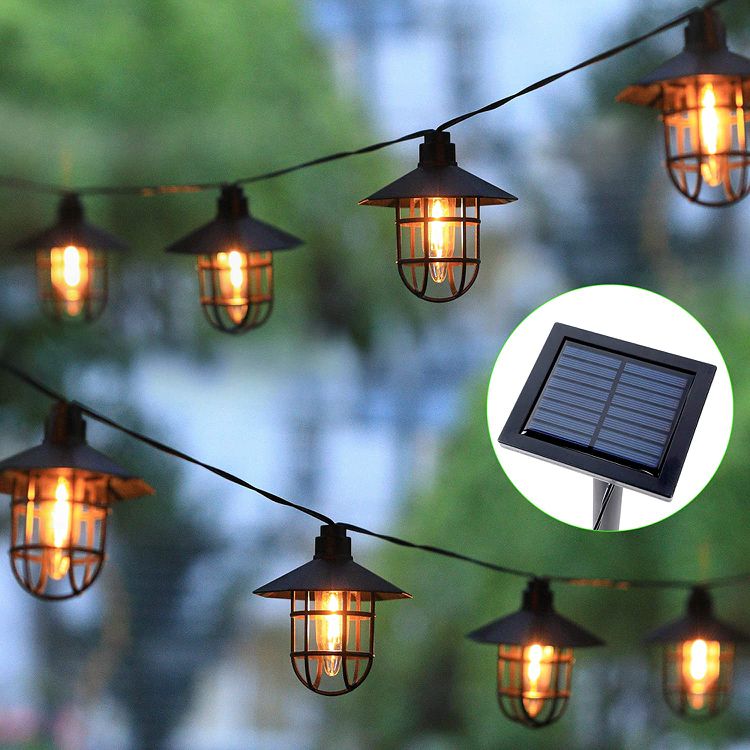
Locate an element on the screen. The width and height of the screenshot is (750, 750). lantern/lamp hanging is located at coordinates (444, 236).